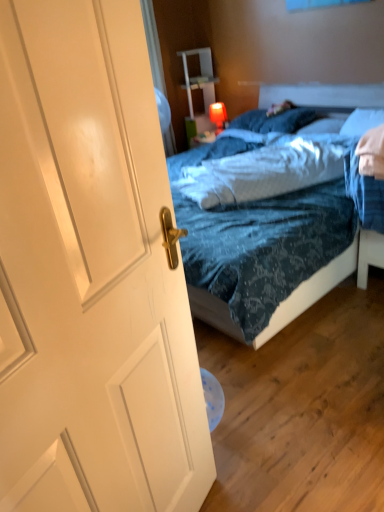
Question: Is white soft pillow at upper center, the second pillow positioned from the left, facing towards blue textured bedsheet at center?

Choices:
 (A) yes
 (B) no

Answer: (A)

Question: Is white soft pillow at upper center, which appears as the 2th pillow when viewed from the right, at the left side of blue textured bedsheet at center?

Choices:
 (A) no
 (B) yes

Answer: (A)

Question: Does white soft pillow at upper center, the second pillow positioned from the left, come behind blue textured bedsheet at center?

Choices:
 (A) yes
 (B) no

Answer: (A)

Question: Considering the relative sizes of white soft pillow at upper center, the second pillow positioned from the left, and blue textured bedsheet at center in the image provided, is white soft pillow at upper center, the second pillow positioned from the left, smaller than blue textured bedsheet at center?

Choices:
 (A) yes
 (B) no

Answer: (A)

Question: Would you say white soft pillow at upper center, the second pillow positioned from the left, is outside blue textured bedsheet at center?

Choices:
 (A) no
 (B) yes

Answer: (B)

Question: In the image, is white matte door at left on the left side or the right side of white soft pillow at upper center, which appears as the 2th pillow when viewed from the right?

Choices:
 (A) right
 (B) left

Answer: (B)

Question: From the image's perspective, is white matte door at left positioned above or below white soft pillow at upper center, the second pillow positioned from the left?

Choices:
 (A) below
 (B) above

Answer: (A)

Question: Relative to white soft pillow at upper center, the second pillow positioned from the left, is white matte door at left in front or behind?

Choices:
 (A) behind
 (B) front

Answer: (B)

Question: Is white matte door at left wider or thinner than white soft pillow at upper center, the second pillow positioned from the left?

Choices:
 (A) thin
 (B) wide

Answer: (A)

Question: Considering the relative positions of white soft pillow at upper center, which appears as the 2th pillow when viewed from the right, and blue textured bedsheet at center in the image provided, is white soft pillow at upper center, which appears as the 2th pillow when viewed from the right, to the left or to the right of blue textured bedsheet at center?

Choices:
 (A) left
 (B) right

Answer: (B)

Question: From the image's perspective, is white soft pillow at upper center, the second pillow positioned from the left, above or below blue textured bedsheet at center?

Choices:
 (A) below
 (B) above

Answer: (B)

Question: Is white soft pillow at upper center, the second pillow positioned from the left, wider or thinner than blue textured bedsheet at center?

Choices:
 (A) wide
 (B) thin

Answer: (B)

Question: Considering the positions of point (344, 120) and point (324, 160), is point (344, 120) closer or farther from the camera than point (324, 160)?

Choices:
 (A) farther
 (B) closer

Answer: (A)

Question: Looking at their shapes, would you say blue textured bedsheet at center is wider or thinner than blue textured pillow at center, the 1th pillow in the left-to-right sequence?

Choices:
 (A) thin
 (B) wide

Answer: (B)

Question: From their relative heights in the image, would you say blue textured bedsheet at center is taller or shorter than blue textured pillow at center, which ranks as the third pillow in right-to-left order?

Choices:
 (A) short
 (B) tall

Answer: (B)